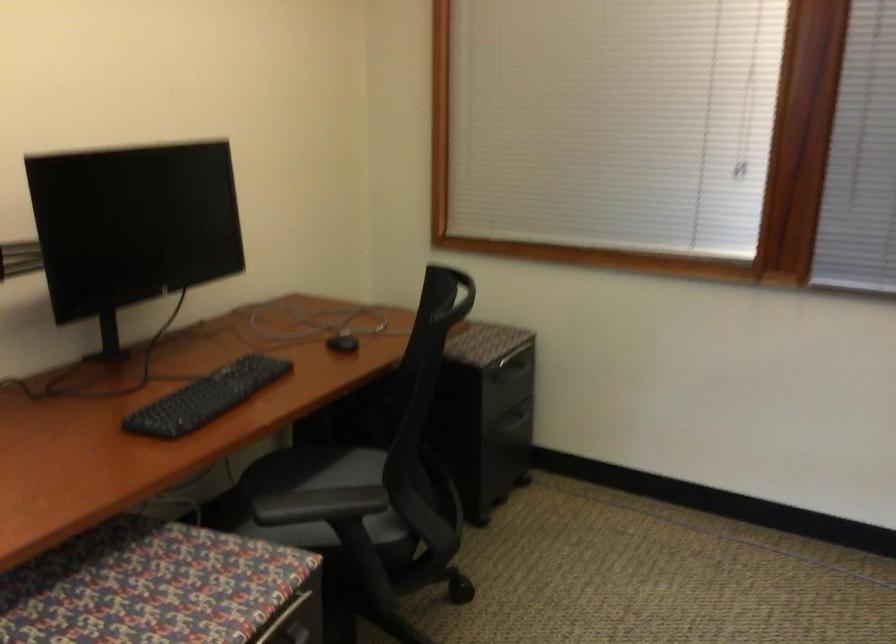
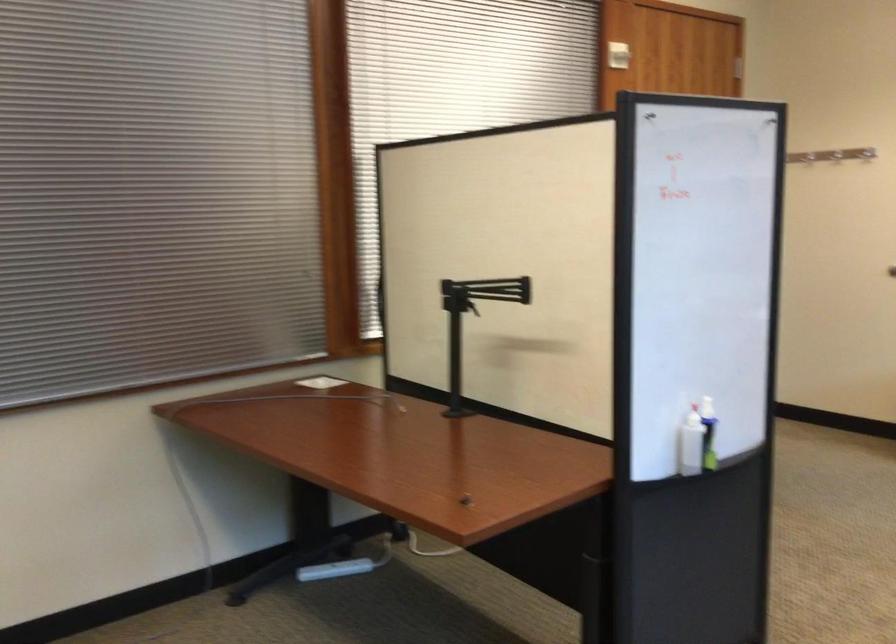
Question: The camera is either moving clockwise (left) or counter-clockwise (right) around the object. The first image is from the beginning of the video and the second image is from the end. Is the camera moving left or right when shooting the video?

Choices:
 (A) Left
 (B) Right

Answer: (A)